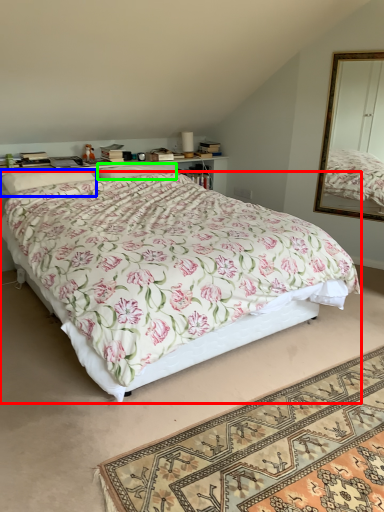
Question: Estimate the real-world distances between objects in this image. Which object is closer to bed (highlighted by a red box), pillow (highlighted by a blue box) or pillow (highlighted by a green box)?

Choices:
 (A) pillow
 (B) pillow

Answer: (A)